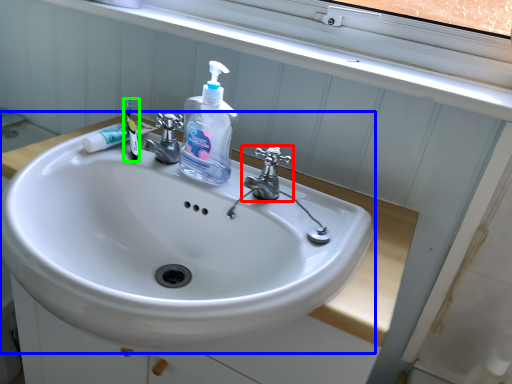
Question: Based on their relative distances, which object is nearer to tap (highlighted by a red box)? Choose from sink (highlighted by a blue box) and toothbrush (highlighted by a green box).

Choices:
 (A) sink
 (B) toothbrush

Answer: (A)